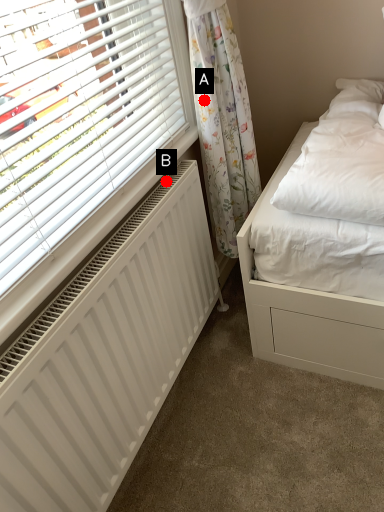
Question: Two points are circled on the image, labeled by A and B beside each circle. Which of the following is the closest to the observer?

Choices:
 (A) A is closer
 (B) B is closer

Answer: (B)